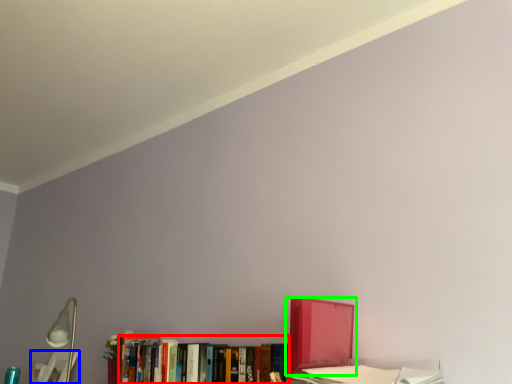
Question: Estimate the real-world distances between objects in this image. Which object is closer to book (highlighted by a red box), book (highlighted by a blue box) or book (highlighted by a green box)?

Choices:
 (A) book
 (B) book

Answer: (B)